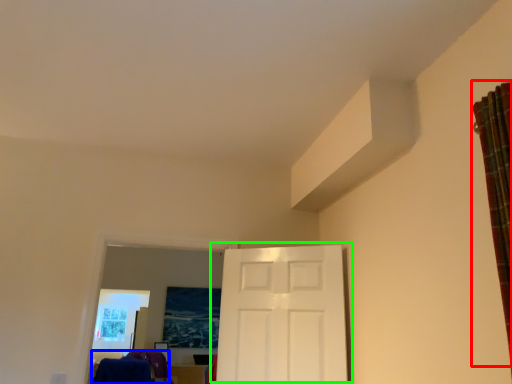
Question: Considering the real-world distances, which object is farthest from curtain (highlighted by a red box)? laundry (highlighted by a blue box) or door (highlighted by a green box)?

Choices:
 (A) laundry
 (B) door

Answer: (A)